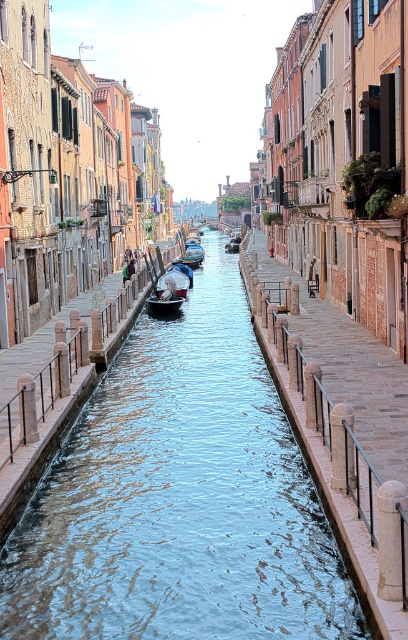
Can you confirm if clear blue water at center is positioned to the left of white glossy boat at center?

In fact, clear blue water at center is to the right of white glossy boat at center.

Is clear blue water at center below white glossy boat at center?

Yes.

What do you see at coordinates (179, 497) in the screenshot? I see `clear blue water at center` at bounding box center [179, 497].

Identify the location of clear blue water at center. click(179, 497).

What do you see at coordinates (179, 497) in the screenshot? I see `clear blue water at center` at bounding box center [179, 497].

Can you confirm if clear blue water at center is positioned to the right of wooden gondola at center?

Indeed, clear blue water at center is positioned on the right side of wooden gondola at center.

Who is more forward, (15, 593) or (190, 257)?

Point (15, 593) is in front.

Identify the location of clear blue water at center. Image resolution: width=408 pixels, height=640 pixels. (179, 497).

Which of these two, white glossy boat at center or wooden gondola at center, stands taller?

Standing taller between the two is wooden gondola at center.

Between white glossy boat at center and wooden gondola at center, which one appears on the left side from the viewer's perspective?

From the viewer's perspective, white glossy boat at center appears more on the left side.

This screenshot has width=408, height=640. In order to click on white glossy boat at center in this screenshot , I will do `click(170, 291)`.